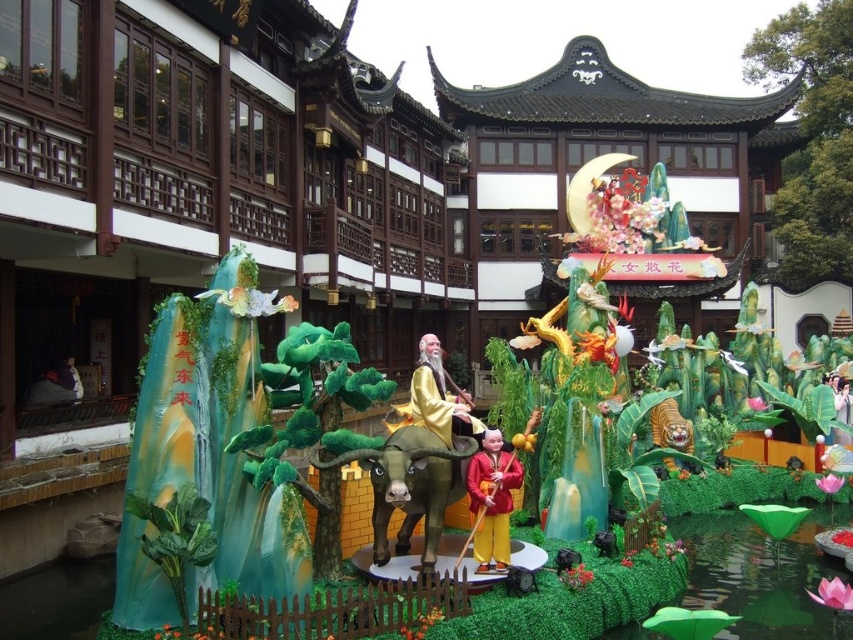
Can you confirm if green matte ox at center is positioned below gold shiny robe at center?

Yes, green matte ox at center is below gold shiny robe at center.

Is point (456, 465) closer to viewer compared to point (433, 349)?

Yes, it is.

What do you see at coordinates (410, 481) in the screenshot? This screenshot has width=853, height=640. I see `green matte ox at center` at bounding box center [410, 481].

Locate an element on the screen. green matte ox at center is located at coordinates (410, 481).

Does smooth red fabric at center lie behind gold shiny robe at center?

No, it is not.

Which is above, smooth red fabric at center or gold shiny robe at center?

gold shiny robe at center

Which is in front, point (473, 484) or point (428, 394)?

Point (473, 484) is in front.

This screenshot has height=640, width=853. What are the coordinates of `smooth red fabric at center` in the screenshot? It's located at (492, 499).

Does green matte ox at center come in front of smooth red fabric at center?

Yes, green matte ox at center is closer to the viewer.

Does point (442, 484) lie in front of point (491, 444)?

Yes, point (442, 484) is closer to viewer.

Who is more distant from viewer, (428, 436) or (482, 563)?

Positioned behind is point (428, 436).

The width and height of the screenshot is (853, 640). Identify the location of green matte ox at center. (410, 481).